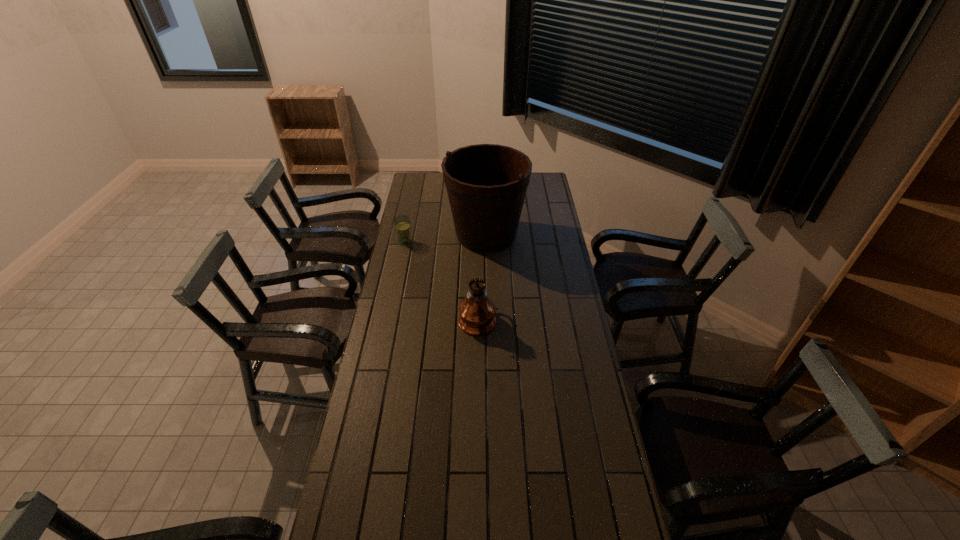
This screenshot has height=540, width=960. I want to click on bucket, so click(486, 184).

At what (x,y) coordinates should I click in order to perform the action: click on oil lamp. Please return your answer as a coordinate pair (x, y). The width and height of the screenshot is (960, 540). Looking at the image, I should click on (477, 312).

Where is `the leftmost object`? The height and width of the screenshot is (540, 960). the leftmost object is located at coordinates (402, 223).

Locate an element on the screen. The image size is (960, 540). glass is located at coordinates (402, 223).

Find the location of a particular element. Image resolution: width=960 pixels, height=540 pixels. free spot located on the back of the bucket is located at coordinates (485, 187).

Locate an element on the screen. This screenshot has width=960, height=540. free space located 0.380m on the back of the nearest object is located at coordinates (478, 246).

This screenshot has height=540, width=960. Find the location of `free space located 0.360m on the right of the glass`. free space located 0.360m on the right of the glass is located at coordinates (485, 241).

Identify the location of object that is at the left edge. Image resolution: width=960 pixels, height=540 pixels. (402, 223).

The image size is (960, 540). In the image, there is a desktop. What are the coordinates of `vacant space at the far edge` in the screenshot? It's located at (438, 190).

At what (x,y) coordinates should I click in order to perform the action: click on vacant region at the left edge. Please return your answer as a coordinate pair (x, y). Looking at the image, I should click on (397, 267).